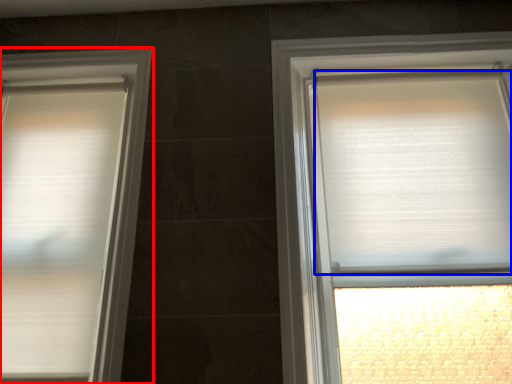
Question: Which object is further to the camera taking this photo, window (highlighted by a red box) or blind (highlighted by a blue box)?

Choices:
 (A) window
 (B) blind

Answer: (B)